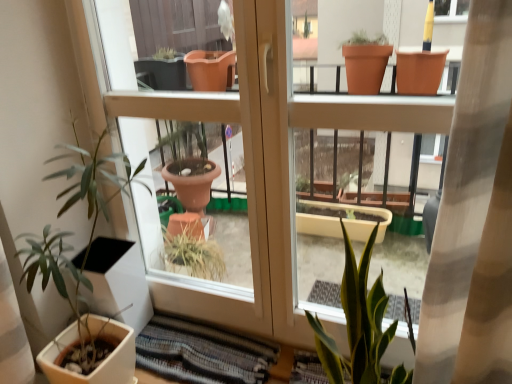
Image resolution: width=512 pixels, height=384 pixels. What do you see at coordinates (202, 353) in the screenshot?
I see `striped fabric rug at lower center` at bounding box center [202, 353].

At what (x,y) coordinates should I click in order to perform the action: click on green matte plant at left. Please return your answer as a coordinate pair (x, y). This screenshot has height=384, width=512. Looking at the image, I should click on tap(73, 233).

From the image's perspective, which is above, matte brown screen door at lower left or striped fabric rug at lower center?

matte brown screen door at lower left is shown above in the image.

Is matte brown screen door at lower left located outside striped fabric rug at lower center?

Yes, matte brown screen door at lower left is located beyond the bounds of striped fabric rug at lower center.

From the image's perspective, is green matte plant at left over matte brown screen door at lower left?

No.

Considering the relative sizes of green matte plant at left and matte brown screen door at lower left in the image provided, is green matte plant at left thinner than matte brown screen door at lower left?

No, green matte plant at left is not thinner than matte brown screen door at lower left.

Is green matte plant at left turned away from matte brown screen door at lower left?

That's right, green matte plant at left is facing away from matte brown screen door at lower left.

From the picture: Does green matte plant at left have a greater height compared to matte brown screen door at lower left?

Incorrect, the height of green matte plant at left is not larger of that of matte brown screen door at lower left.

Is matte brown screen door at lower left completely or partially outside of green matte plant at left?

Yes, matte brown screen door at lower left is not within green matte plant at left.

Is matte brown screen door at lower left far away from green matte plant at left?

No, matte brown screen door at lower left is not far from green matte plant at left.

Is matte brown screen door at lower left positioned with its back to green matte plant at left?

Yes, matte brown screen door at lower left's orientation is away from green matte plant at left.

Where is `screen door that appears above the green matte plant at left (from a real-world perspective)`? screen door that appears above the green matte plant at left (from a real-world perspective) is located at coordinates (236, 185).

Could you tell me if striped fabric rug at lower center is facing green matte plant at left?

No, striped fabric rug at lower center is not turned towards green matte plant at left.

Which is further, [143,355] or [69,189]?

Positioned behind is point [143,355].

From a real-world perspective, does striped fabric rug at lower center sit lower than green matte plant at left?

Yes, from a real-world perspective, striped fabric rug at lower center is under green matte plant at left.

Is point (162, 346) positioned after point (236, 101)?

Yes, it is behind point (236, 101).

Could you tell me if striped fabric rug at lower center is facing matte brown screen door at lower left?

No, striped fabric rug at lower center does not turn towards matte brown screen door at lower left.

Is striped fabric rug at lower center smaller than matte brown screen door at lower left?

Yes.

Does striped fabric rug at lower center lie behind matte brown screen door at lower left?

Yes.

Is green matte plant at left looking in the opposite direction of striped fabric rug at lower center?

No, green matte plant at left is not facing the opposite direction of striped fabric rug at lower center.

From the image's perspective, is green matte plant at left positioned above or below striped fabric rug at lower center?

green matte plant at left is above striped fabric rug at lower center.

Consider the image. From a real-world perspective, is green matte plant at left positioned over striped fabric rug at lower center based on gravity?

Correct, in the physical world, green matte plant at left is higher than striped fabric rug at lower center.

Considering the positions of objects green matte plant at left and striped fabric rug at lower center in the image provided, who is in front, green matte plant at left or striped fabric rug at lower center?

green matte plant at left is closer to the camera.

The width and height of the screenshot is (512, 384). In order to click on atrium below the matte brown screen door at lower left (from a real-world perspective) in this screenshot , I will do `click(202, 353)`.

Locate an element on the screen. The width and height of the screenshot is (512, 384). screen door behind the green matte plant at left is located at coordinates (236, 185).

Which object lies nearer to the anchor point striped fabric rug at lower center, green matte plant at left or matte brown screen door at lower left?

Based on the image, matte brown screen door at lower left appears to be nearer to striped fabric rug at lower center.

Based on the photo, from the image, which object appears to be farther from striped fabric rug at lower center, matte brown screen door at lower left or green matte plant at left?

The object further to striped fabric rug at lower center is green matte plant at left.

From the image, which object appears to be nearer to green matte plant at left, striped fabric rug at lower center or matte brown screen door at lower left?

matte brown screen door at lower left is positioned closer to the anchor green matte plant at left.

Based on their spatial positions, is striped fabric rug at lower center or green matte plant at left further from matte brown screen door at lower left?

Among the two, green matte plant at left is located further to matte brown screen door at lower left.

In the scene shown: From the image, which object appears to be nearer to green matte plant at left, matte brown screen door at lower left or striped fabric rug at lower center?

The object closer to green matte plant at left is matte brown screen door at lower left.

Based on their spatial positions, is green matte plant at left or striped fabric rug at lower center further from matte brown screen door at lower left?

The object further to matte brown screen door at lower left is green matte plant at left.

Identify the location of houseplant between matte brown screen door at lower left and striped fabric rug at lower center in the vertical direction. This screenshot has width=512, height=384. (73, 233).